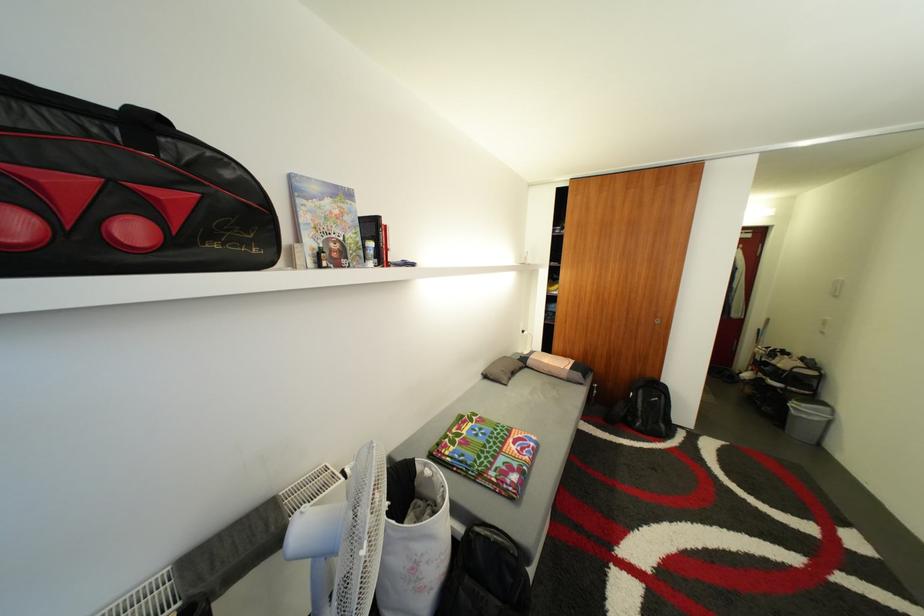
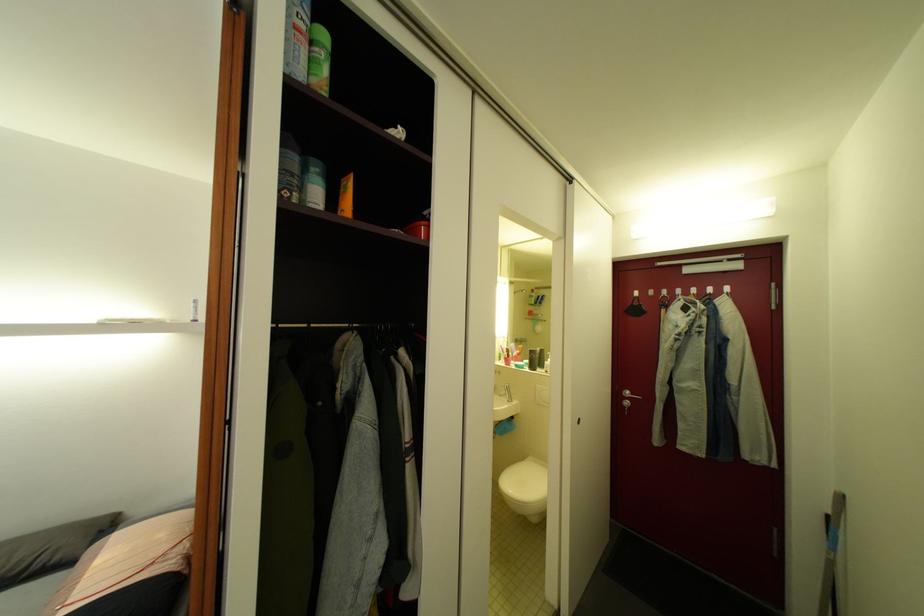
The images are taken continuously from a first-person perspective. In which direction are you moving?

The cameraman moved toward right, forward.